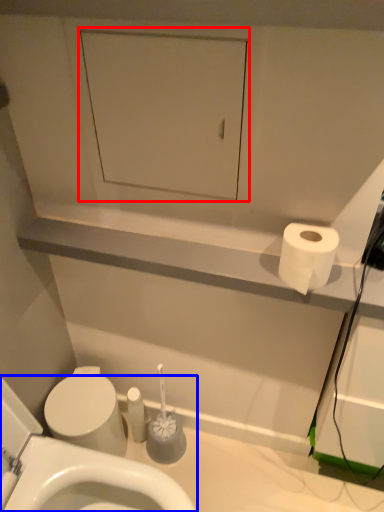
Question: Which point is further to the camera, medicine cabinet (highlighted by a red box) or toilet (highlighted by a blue box)?

Choices:
 (A) medicine cabinet
 (B) toilet

Answer: (A)